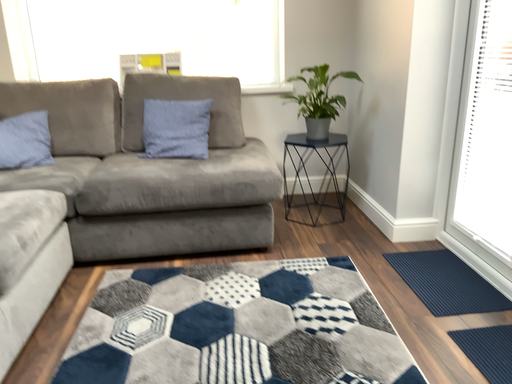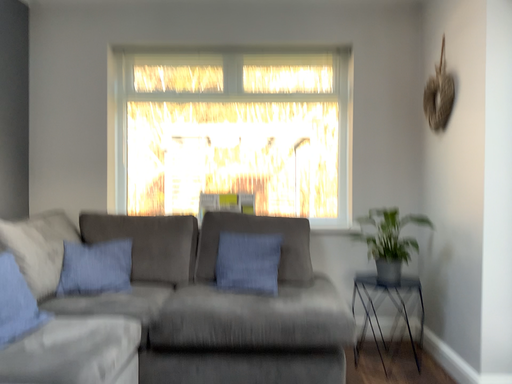
Question: Which way did the camera rotate in the video?

Choices:
 (A) rotated downward
 (B) rotated upward

Answer: (B)